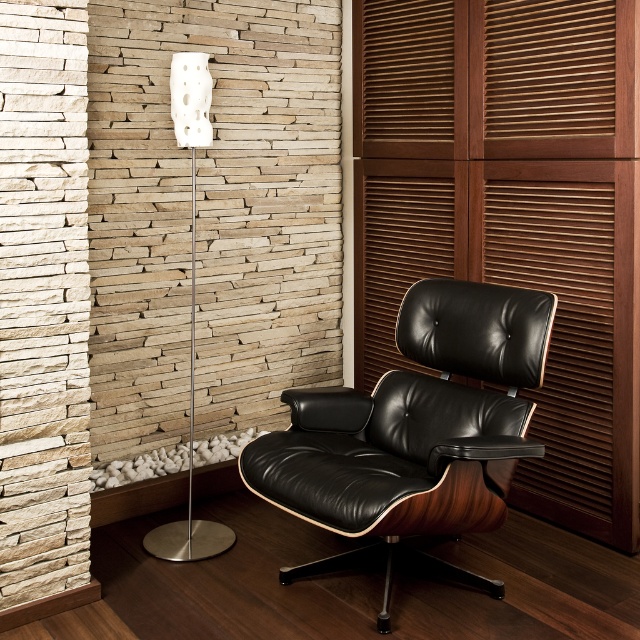
Who is higher up, black leather swivel chair at center or white matte floor lamp at left?

white matte floor lamp at left

Does black leather swivel chair at center come in front of white matte floor lamp at left?

Yes, black leather swivel chair at center is closer to the viewer.

Does point (481, 584) lie in front of point (177, 76)?

That is True.

Find the location of a particular element. The image size is (640, 640). black leather swivel chair at center is located at coordinates pyautogui.click(x=413, y=433).

Between point (592, 260) and point (328, 525), which one is positioned behind?

The point (592, 260) is more distant.

Can you confirm if wooden slats at right is wider than black leather swivel chair at center?

No.

Between point (637, 195) and point (410, 472), which one is positioned behind?

The point (637, 195) is behind.

Locate an element on the screen. The height and width of the screenshot is (640, 640). wooden slats at right is located at coordinates (513, 211).

Which is more to the left, wooden slats at right or white matte floor lamp at left?

From the viewer's perspective, white matte floor lamp at left appears more on the left side.

Consider the image. Who is shorter, wooden slats at right or white matte floor lamp at left?

Standing shorter between the two is white matte floor lamp at left.

At what (x,y) coordinates should I click in order to perform the action: click on wooden slats at right. Please return your answer as a coordinate pair (x, y). Looking at the image, I should click on (513, 211).